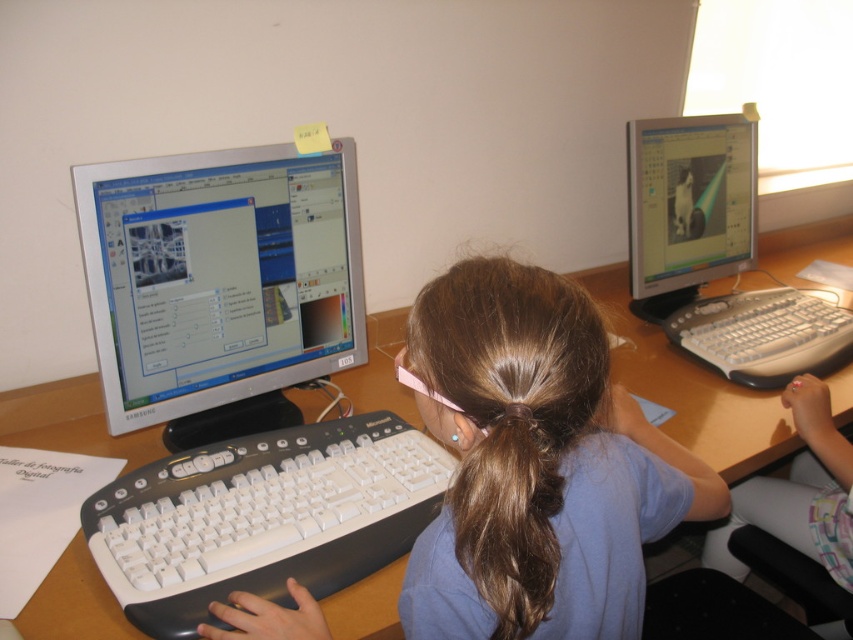
Which is above, matte silver monitor at right or brown silky hair at center?

matte silver monitor at right is above.

Identify the location of matte silver monitor at right. The image size is (853, 640). (717, 253).

Who is higher up, white plastic computer desk at center or matte plastic monitor at upper right?

matte plastic monitor at upper right is higher up.

Where is `white plastic computer desk at center`? The image size is (853, 640). white plastic computer desk at center is located at coordinates (691, 388).

Who is more distant from viewer, [368,362] or [685,141]?

The point [685,141] is behind.

The width and height of the screenshot is (853, 640). In order to click on white plastic computer desk at center in this screenshot , I will do `click(691, 388)`.

Who is higher up, silver/black plastic monitor at left or brown silky hair at center?

Positioned higher is silver/black plastic monitor at left.

Who is more forward, [306,156] or [505,499]?

Point [505,499] is in front.

Describe the element at coordinates (219, 284) in the screenshot. I see `silver/black plastic monitor at left` at that location.

The width and height of the screenshot is (853, 640). I want to click on silver/black plastic monitor at left, so click(x=219, y=284).